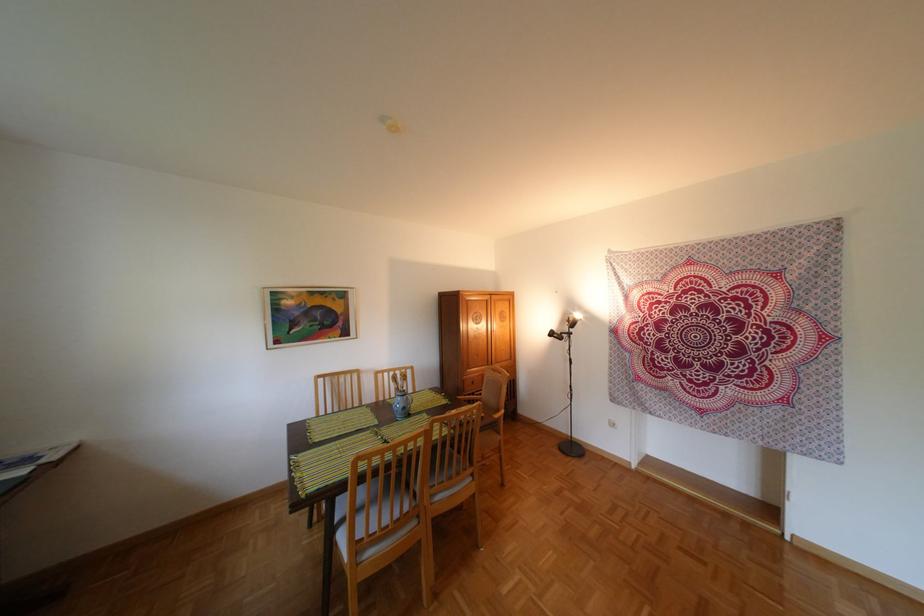
Where is `cabinet door handle`? The height and width of the screenshot is (616, 924). cabinet door handle is located at coordinates [496, 336].